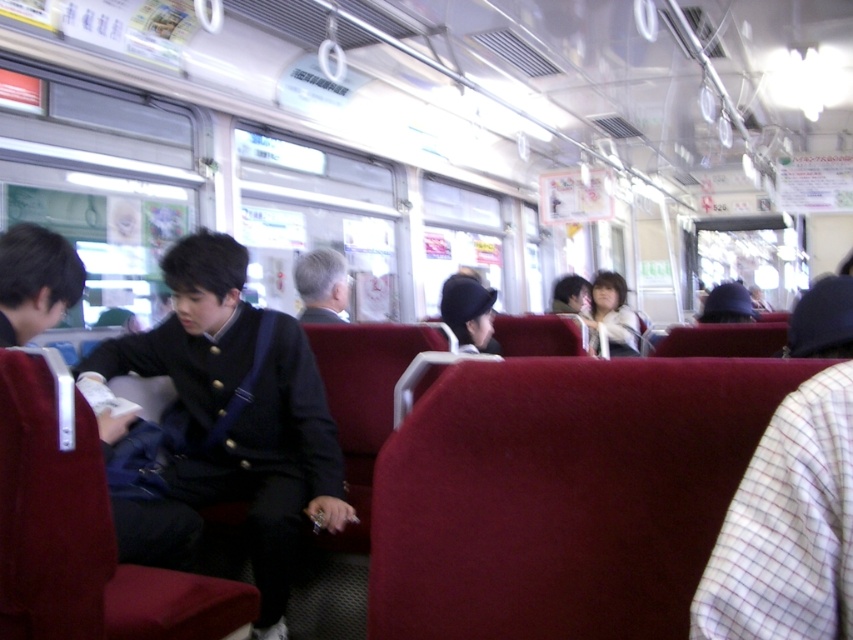
Who is shorter, matte black jacket at center or white fuzzy jacket at center?

white fuzzy jacket at center is shorter.

Does matte black jacket at center have a larger size compared to white fuzzy jacket at center?

Correct, matte black jacket at center is larger in size than white fuzzy jacket at center.

The height and width of the screenshot is (640, 853). In order to click on matte black jacket at center in this screenshot , I will do `click(239, 410)`.

Identify the location of matte black jacket at center. The height and width of the screenshot is (640, 853). 239,410.

Based on the photo, between white checkered fabric at right and white fuzzy jacket at center, which one has more height?

Standing taller between the two is white fuzzy jacket at center.

From the picture: Does white checkered fabric at right have a smaller size compared to white fuzzy jacket at center?

Indeed, white checkered fabric at right has a smaller size compared to white fuzzy jacket at center.

Does point (798, 474) come behind point (610, 352)?

No.

Identify the location of white checkered fabric at right. (788, 525).

Does matte black jacket at center have a smaller size compared to white checkered fabric at right?

No, matte black jacket at center is not smaller than white checkered fabric at right.

Can you confirm if matte black jacket at center is positioned above white checkered fabric at right?

No.

Is point (271, 408) farther from camera compared to point (834, 586)?

Yes, point (271, 408) is farther from viewer.

You are a GUI agent. You are given a task and a screenshot of the screen. Output one action in this format:
    pyautogui.click(x=<x>, y=<y>)
    Task: Click on the matte black jacket at center
    Image resolution: width=853 pixels, height=640 pixels.
    Given the screenshot: What is the action you would take?
    point(239,410)